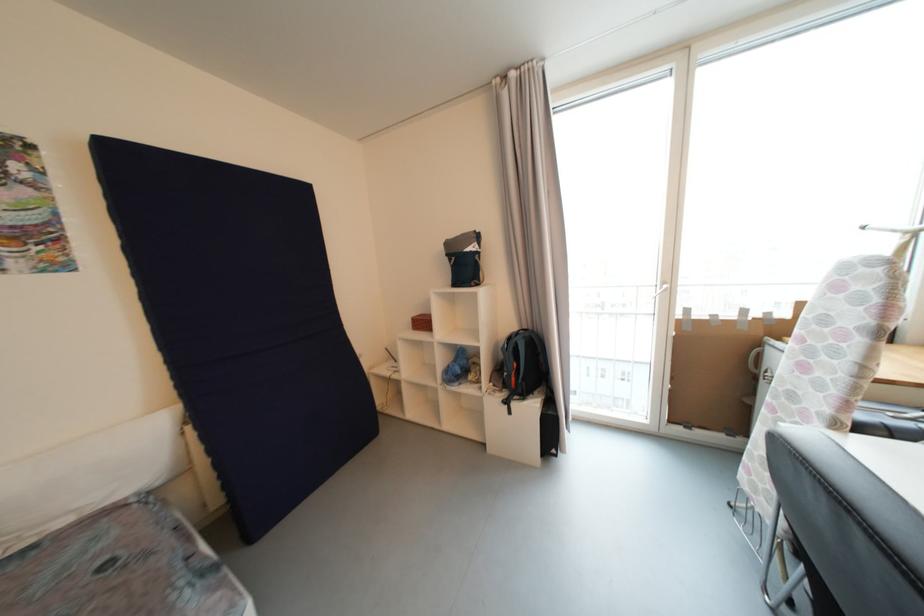
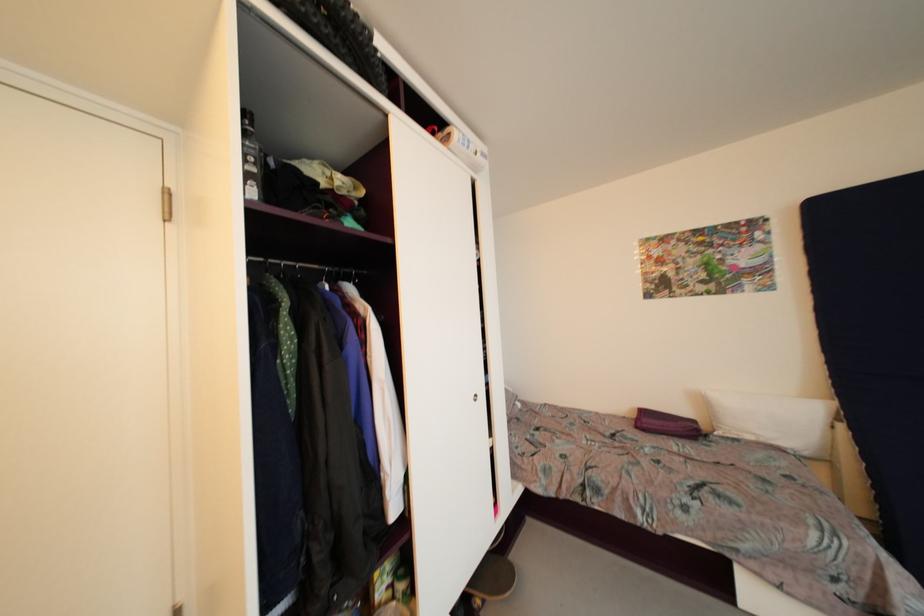
In the second image, find the point that corresponds to (164,485) in the first image.

(810, 456)